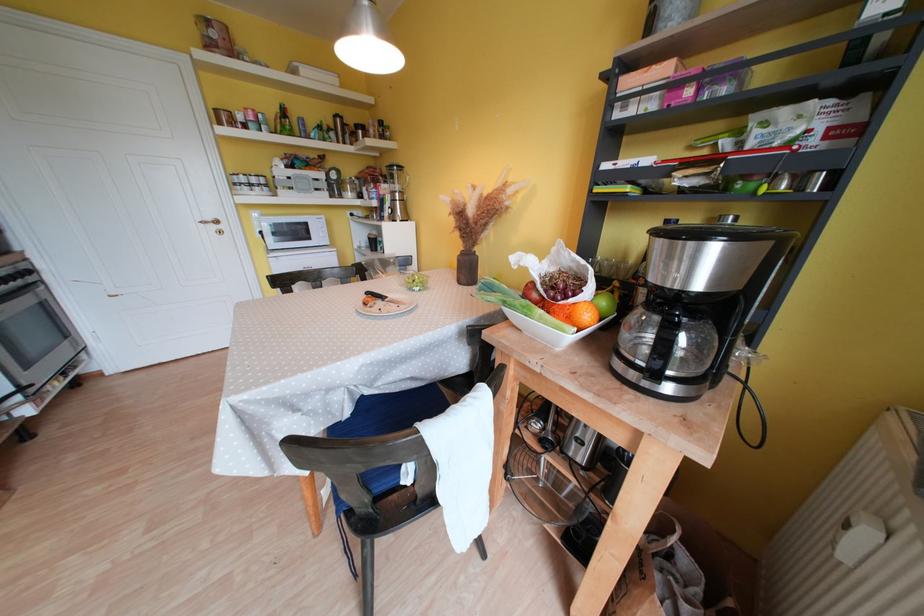
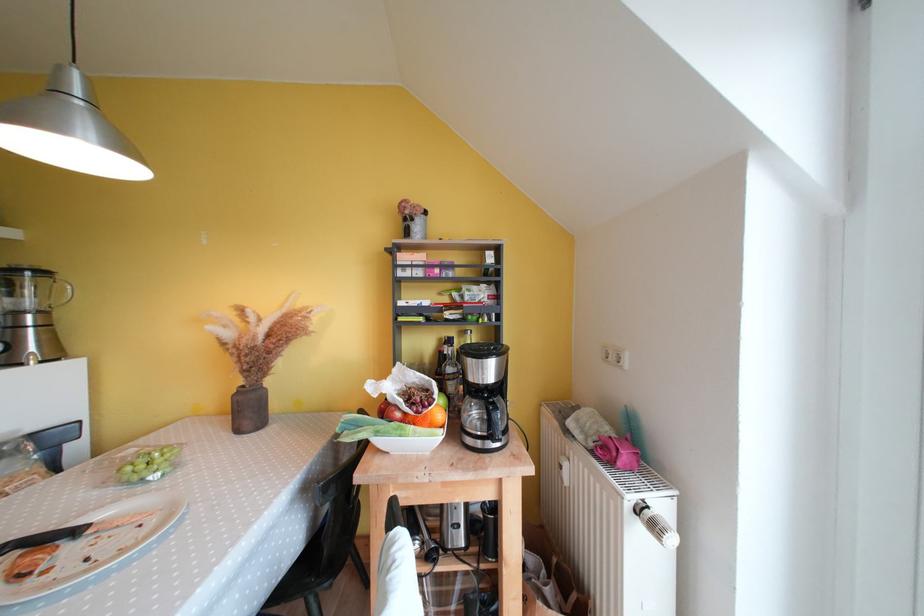
Locate, in the second image, the point that corresponds to point (407, 196) in the first image.

(49, 315)